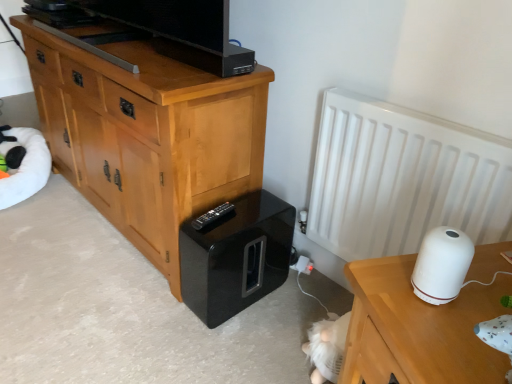
I want to click on free spot in front of white glossy humidifier at right, so click(x=436, y=331).